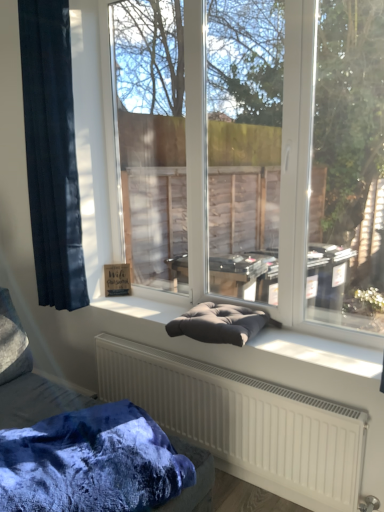
Question: Is dark blue fabric at left smaller than dark gray fabric cushion at center?

Choices:
 (A) yes
 (B) no

Answer: (B)

Question: Is the surface of dark blue fabric at left in direct contact with dark gray fabric cushion at center?

Choices:
 (A) yes
 (B) no

Answer: (B)

Question: Is dark blue fabric at left far away from dark gray fabric cushion at center?

Choices:
 (A) yes
 (B) no

Answer: (B)

Question: From the image's perspective, is dark blue fabric at left located beneath dark gray fabric cushion at center?

Choices:
 (A) yes
 (B) no

Answer: (B)

Question: Is the position of dark blue fabric at left less distant than that of dark gray fabric cushion at center?

Choices:
 (A) no
 (B) yes

Answer: (A)

Question: Considering the positions of matte gray cushion at center and dark gray fabric cushion at center in the image, is matte gray cushion at center bigger or smaller than dark gray fabric cushion at center?

Choices:
 (A) small
 (B) big

Answer: (B)

Question: Is matte gray cushion at center in front of or behind dark gray fabric cushion at center in the image?

Choices:
 (A) front
 (B) behind

Answer: (A)

Question: Is point (345, 187) closer or farther from the camera than point (211, 322)?

Choices:
 (A) closer
 (B) farther

Answer: (B)

Question: Choose the correct answer: Is matte gray cushion at center inside dark gray fabric cushion at center or outside it?

Choices:
 (A) inside
 (B) outside

Answer: (B)

Question: Would you say dark gray fabric cushion at center is to the left or to the right of velvet cushion at center in the picture?

Choices:
 (A) left
 (B) right

Answer: (B)

Question: From the image's perspective, is dark gray fabric cushion at center located above or below velvet cushion at center?

Choices:
 (A) above
 (B) below

Answer: (A)

Question: In terms of height, does dark gray fabric cushion at center look taller or shorter compared to velvet cushion at center?

Choices:
 (A) short
 (B) tall

Answer: (A)

Question: From a real-world perspective, is dark gray fabric cushion at center positioned above or below velvet cushion at center?

Choices:
 (A) below
 (B) above

Answer: (B)

Question: Considering the positions of dark gray fabric cushion at center and velvety blue blanket at lower left in the image, is dark gray fabric cushion at center wider or thinner than velvety blue blanket at lower left?

Choices:
 (A) wide
 (B) thin

Answer: (B)

Question: Considering the relative positions of dark gray fabric cushion at center and velvety blue blanket at lower left in the image provided, is dark gray fabric cushion at center to the left or to the right of velvety blue blanket at lower left?

Choices:
 (A) right
 (B) left

Answer: (A)